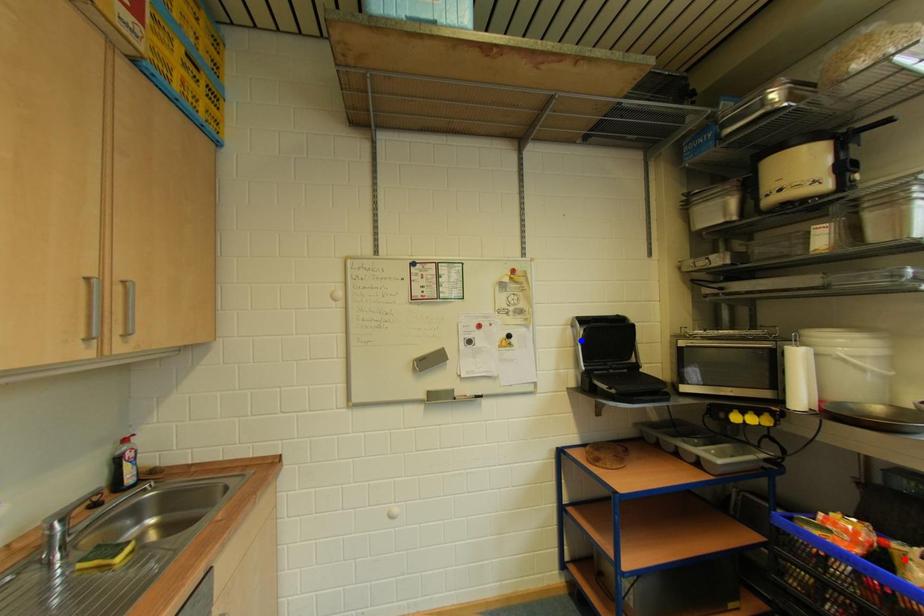
Question: Which of the two points in the image is closer to the camera?

Choices:
 (A) Blue point is closer.
 (B) Red point is closer.

Answer: (B)